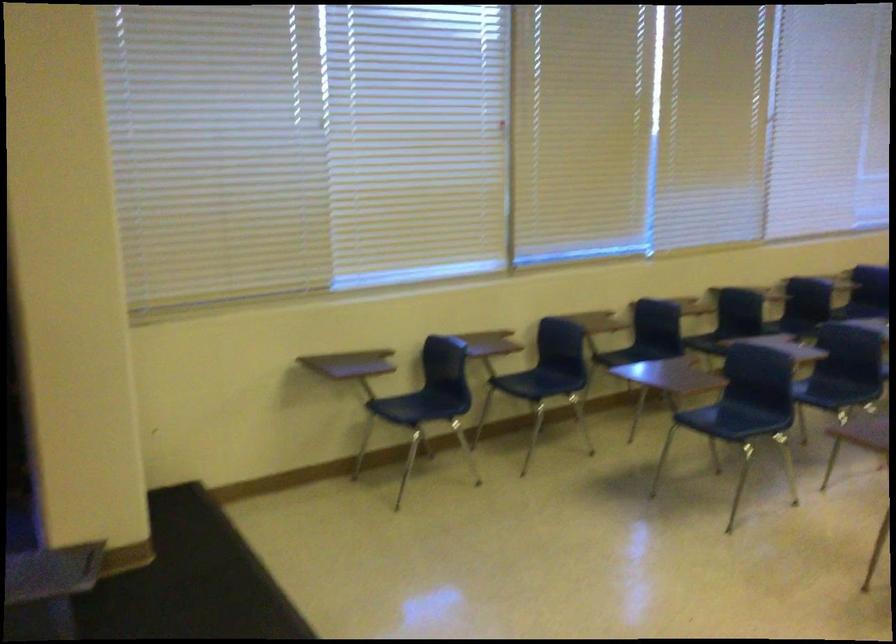
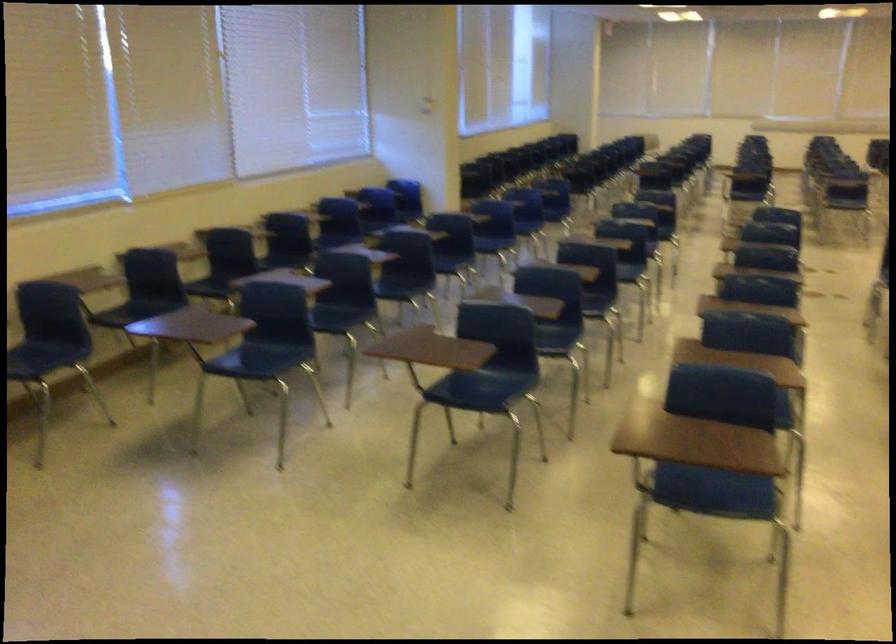
Question: How did the camera likely rotate?

Choices:
 (A) Left
 (B) Right
 (C) Up
 (D) Down

Answer: (B)